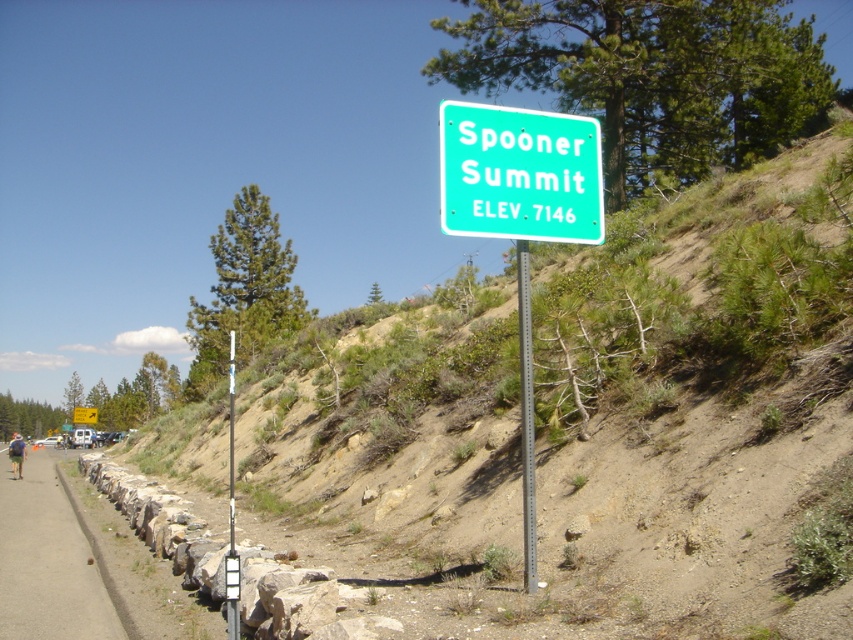
Question: Is smooth asphalt path at lower left closer to camera compared to green plastic arrow at upper right?

Choices:
 (A) yes
 (B) no

Answer: (A)

Question: Estimate the real-world distances between objects in this image. Which object is farther from the green plastic arrow at upper right?

Choices:
 (A) orange fabric backpack at lower left
 (B) green matte sign at upper center
 (C) smooth asphalt path at lower left
 (D) green plastic sign at center

Answer: (D)

Question: Which of the following is the closest to the observer?

Choices:
 (A) green matte sign at upper center
 (B) green grassy hillside at upper center
 (C) orange fabric backpack at lower left

Answer: (B)

Question: Can you confirm if green grassy hillside at upper center is bigger than green matte sign at upper center?

Choices:
 (A) no
 (B) yes

Answer: (B)

Question: Is green plastic sign at center positioned behind green matte sign at upper center?

Choices:
 (A) no
 (B) yes

Answer: (A)

Question: Which is nearer to the green plastic arrow at upper right?

Choices:
 (A) green plastic sign at center
 (B) smooth asphalt path at lower left
 (C) orange fabric backpack at lower left
 (D) green matte sign at upper center

Answer: (C)